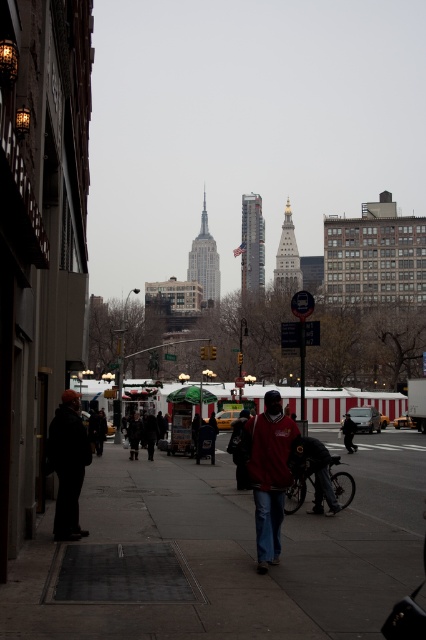
You are a delivery person trying to navigate through the sidewalk. You see the concrete sidewalk at center and the dark gray jacket at left. Which path has more space to walk through?

The concrete sidewalk at center has more space to walk through since its width is larger than the dark gray jacket at left.